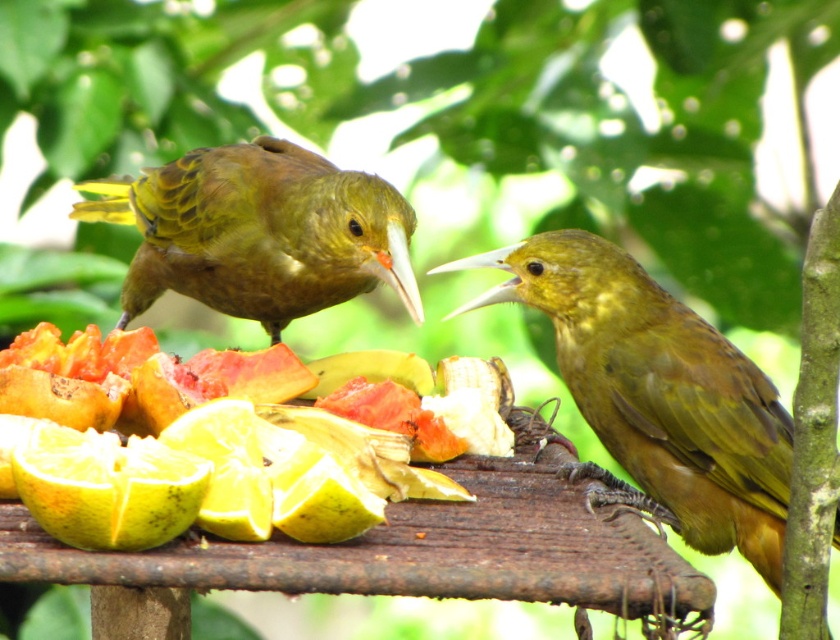
You are a birdwatcher trying to observe the green matte bird at center and the ripe yellow orange at lower left. Which object is closer to you?

The green matte bird at center is closer to you than the ripe yellow orange at lower left because it is further to the viewer according to the description.

You are a bird with a wingspan of 20 inches. You want to fly from your current position to the ripe yellow orange at lower left, but you need to avoid hitting the green matte bird at center. Can you safely reach the orange without touching the bird?

The distance between the green matte bird at center and the ripe yellow orange at lower left is 28.43 inches. Since your wingspan is only 20 inches, you have enough space to fly between them without touching either object.

You are a bird enthusiast observing the scene. You notice the green matte bird at right and the ripe yellow orange at lower left. Which object occupies more space in the image?

The green matte bird at right is bigger than the ripe yellow orange at lower left, so it occupies more space in the image.